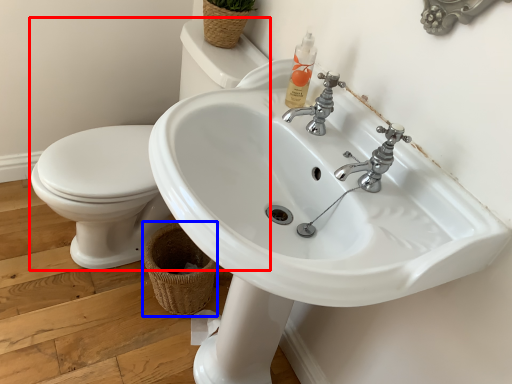
Question: Which object is further to the camera taking this photo, sink (highlighted by a red box) or basket (highlighted by a blue box)?

Choices:
 (A) sink
 (B) basket

Answer: (B)